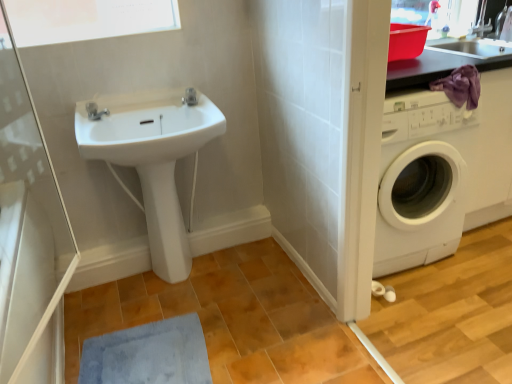
Question: From the image's perspective, relative to metallic gray countertop at upper right, is transparent glass screen door at upper left above or below?

Choices:
 (A) above
 (B) below

Answer: (B)

Question: Do you think transparent glass screen door at upper left is within metallic gray countertop at upper right, or outside of it?

Choices:
 (A) inside
 (B) outside

Answer: (B)

Question: Which object is the farthest from the white glossy sink at center?

Choices:
 (A) white glossy bidet at center
 (B) white glossy cabinet at lower left
 (C) blue soft bath mat at lower left
 (D) transparent glass screen door at upper left
 (E) matte silver tap at upper left, the first tap from the bottom

Answer: (C)

Question: Considering the real-world distances, which object is farthest from the satin chrome faucet at upper center, positioned as the 2th tap in front-to-back order?

Choices:
 (A) white glossy cabinet at lower left
 (B) blue soft bath mat at lower left
 (C) matte silver tap at upper left, the first tap from the bottom
 (D) metallic gray countertop at upper right
 (E) white glossy sink at center

Answer: (D)